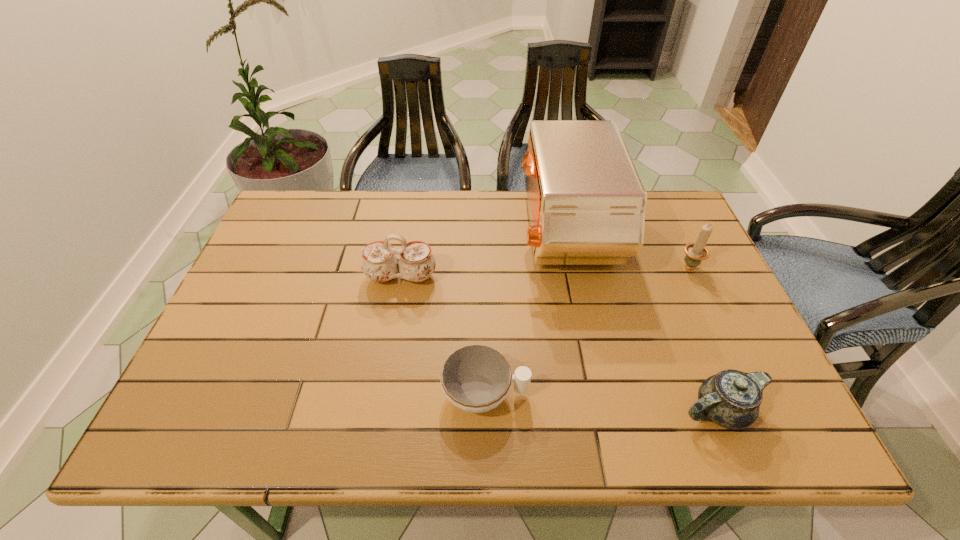
Identify the location of object that is at the far edge. (586, 202).

Locate an element on the screen. The width and height of the screenshot is (960, 540). candle_holder that is at the right edge is located at coordinates (695, 252).

Find the location of a particular element. chinaware at the right edge is located at coordinates (731, 399).

This screenshot has width=960, height=540. In order to click on object that is positioned at the near right corner in this screenshot , I will do `click(731, 399)`.

This screenshot has width=960, height=540. Identify the location of free space at the far edge of the desktop. (344, 201).

In the image, there is a desktop. Identify the location of free space at the near edge. (271, 411).

The image size is (960, 540). Find the location of `vacant space at the left edge`. vacant space at the left edge is located at coordinates (270, 301).

Where is `free region at the far left corner of the desktop`? This screenshot has width=960, height=540. free region at the far left corner of the desktop is located at coordinates [321, 201].

Where is `free spot between the third object from left to right and the shortest object`? free spot between the third object from left to right and the shortest object is located at coordinates (525, 314).

What are the coordinates of `vacant space that's between the candle_holder and the second shortest object` in the screenshot? It's located at (704, 338).